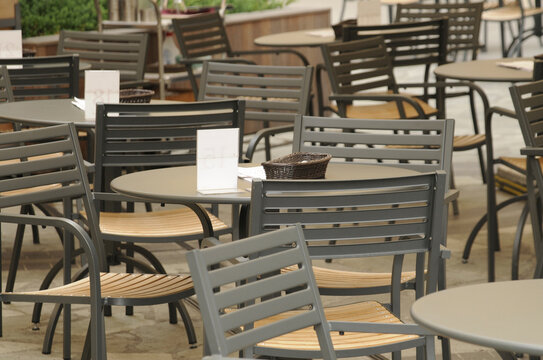
At what (x,y) coordinates should I click in order to perform the action: click on round tables. Please return your answer as a coordinate pair (x, y). Image resolution: width=543 pixels, height=360 pixels. Looking at the image, I should click on (289, 41), (485, 72), (344, 171), (56, 116), (507, 310), (84, 67).